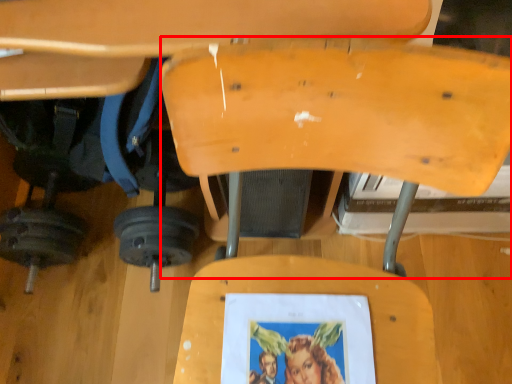
Question: From the image's perspective, what is the correct spatial positioning of swivel chair (annotated by the red box) in reference to barbell?

Choices:
 (A) above
 (B) below

Answer: (A)